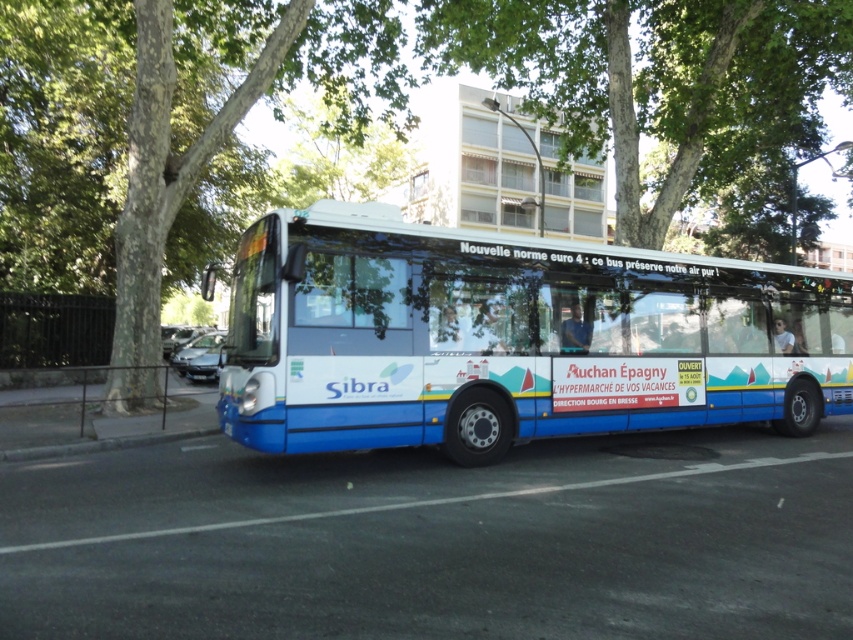
Question: Which of the following is the closest to the observer?

Choices:
 (A) (276, 419)
 (B) (19, 140)

Answer: (A)

Question: From the image, what is the correct spatial relationship of blue metallic bus at center in relation to green leafy tree at upper center?

Choices:
 (A) below
 (B) above

Answer: (A)

Question: Is blue metallic bus at center to the left of green leafy tree at upper center from the viewer's perspective?

Choices:
 (A) no
 (B) yes

Answer: (A)

Question: Does blue metallic bus at center have a greater width compared to green leafy tree at upper center?

Choices:
 (A) yes
 (B) no

Answer: (B)

Question: Which point is farther from the camera taking this photo?

Choices:
 (A) (767, 268)
 (B) (154, 307)

Answer: (B)

Question: Which point appears farthest from the camera in this image?

Choices:
 (A) (576, 412)
 (B) (62, 276)

Answer: (B)